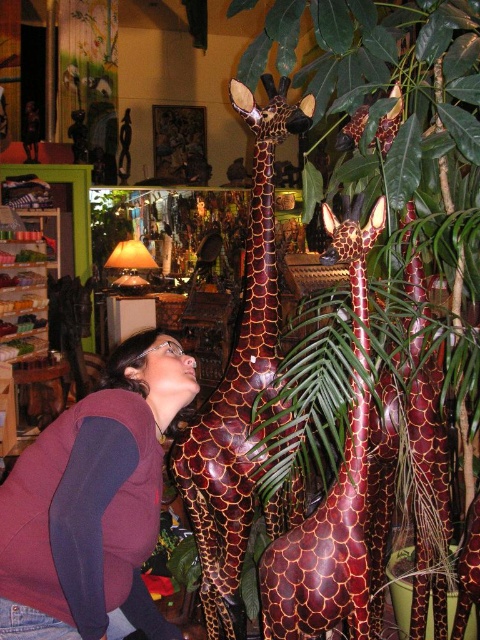
Question: Is the position of shiny brown giraffe at center less distant than that of shiny metallic giraffe at center?

Choices:
 (A) yes
 (B) no

Answer: (A)

Question: Which is farther from the green leafy plant at center?

Choices:
 (A) maroon sweater at lower left
 (B) shiny brown giraffe at center
 (C) shiny metallic giraffe at center

Answer: (A)

Question: Is maroon sweater at lower left positioned in front of shiny brown giraffe at center?

Choices:
 (A) no
 (B) yes

Answer: (B)

Question: Which object appears farthest from the camera in this image?

Choices:
 (A) green leafy plant at center
 (B) shiny metallic giraffe at center

Answer: (B)

Question: Which of these objects is positioned closest to the green leafy plant at center?

Choices:
 (A) maroon sweater at lower left
 (B) shiny metallic giraffe at center
 (C) shiny brown giraffe at center
 (D) brown scaly giraffe at center

Answer: (B)

Question: Is green leafy plant at center to the right of maroon sweater at lower left from the viewer's perspective?

Choices:
 (A) yes
 (B) no

Answer: (A)